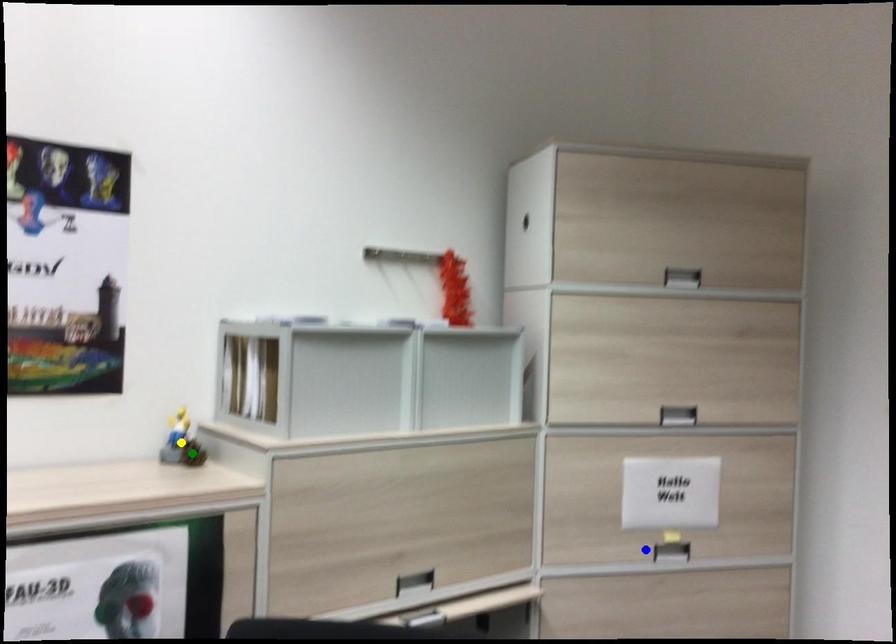
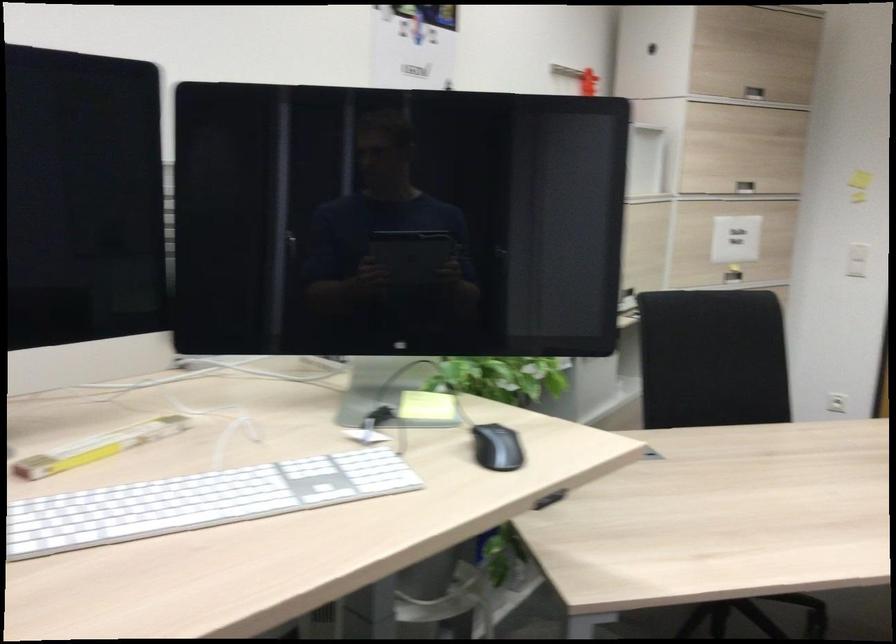
I am providing you with two images of the same scene from different viewpoints. Three points are marked in image1. Which point corresponds to a part or object that is occluded in image2?In image1, three points are marked. Which of them correspond to a part or object that is occluded in image2?Among the three points shown in image1, which one corresponds to a part or object that is no longer visible due to occlusion in image2?

yellow point, green point